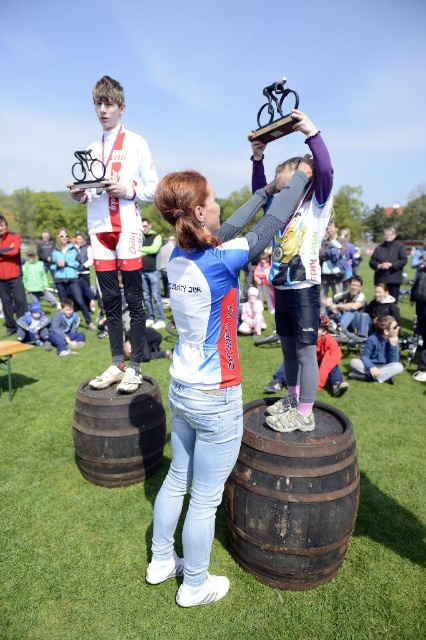
You are a photographer at the event. You want to take a photo that includes both the white matte jersey at center and the metallic silver bicycle at upper center. Which object will appear smaller in the photo?

The white matte jersey at center will appear smaller in the photo because it has a lesser height compared to the metallic silver bicycle at upper center.

You are a photographer at the event and want to take a photo that includes both the white matte jersey at center and the brown wooden barrel at lower center. Which object should be placed closer to the camera to ensure both are clearly visible in the photo?

The white matte jersey at center is bigger than the brown wooden barrel at lower center, so to ensure both are clearly visible in the photo, the brown wooden barrel at lower center should be placed closer to the camera.

You are a photographer at the event and want to capture a wide shot of both the dark brown wooden barrel at center and the metallic silver bicycle at upper center in the same frame. Given that your camera has a fixed focal length, which object should you position closer to the camera to ensure both are fully visible?

To ensure both the dark brown wooden barrel at center and the metallic silver bicycle at upper center are fully visible in the same frame, you should position the dark brown wooden barrel at center closer to the camera. Since the barrel is narrower than the bicycle, placing it closer will help maintain the bicycle further back, allowing both to fit within the frame.